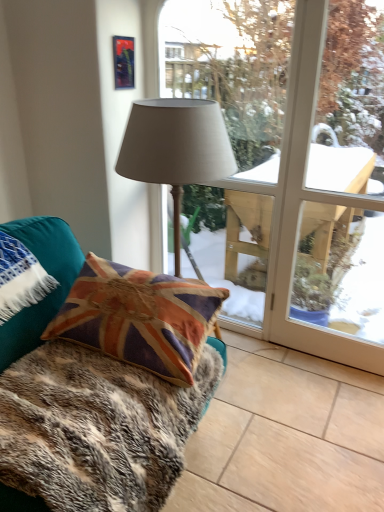
Question: Would you say metallic reflective picture frame at upper center is part of velvet union jack pillow at lower left's contents?

Choices:
 (A) no
 (B) yes

Answer: (A)

Question: Is velvet union jack pillow at lower left at the right side of metallic reflective picture frame at upper center?

Choices:
 (A) yes
 (B) no

Answer: (A)

Question: Are velvet union jack pillow at lower left and metallic reflective picture frame at upper center far apart?

Choices:
 (A) yes
 (B) no

Answer: (B)

Question: Does velvet union jack pillow at lower left have a greater width compared to metallic reflective picture frame at upper center?

Choices:
 (A) yes
 (B) no

Answer: (A)

Question: Can you confirm if velvet union jack pillow at lower left is taller than metallic reflective picture frame at upper center?

Choices:
 (A) yes
 (B) no

Answer: (A)

Question: Is velvet union jack pillow at lower left next to metallic reflective picture frame at upper center?

Choices:
 (A) no
 (B) yes

Answer: (A)

Question: Is matte gray lampshade at center positioned beyond the bounds of metallic reflective picture frame at upper center?

Choices:
 (A) yes
 (B) no

Answer: (A)

Question: Does matte gray lampshade at center have a larger size compared to metallic reflective picture frame at upper center?

Choices:
 (A) yes
 (B) no

Answer: (A)

Question: Does matte gray lampshade at center appear on the right side of metallic reflective picture frame at upper center?

Choices:
 (A) no
 (B) yes

Answer: (B)

Question: Is matte gray lampshade at center smaller than metallic reflective picture frame at upper center?

Choices:
 (A) no
 (B) yes

Answer: (A)

Question: From the image's perspective, is matte gray lampshade at center under metallic reflective picture frame at upper center?

Choices:
 (A) yes
 (B) no

Answer: (A)

Question: Is matte gray lampshade at center to the left of metallic reflective picture frame at upper center from the viewer's perspective?

Choices:
 (A) no
 (B) yes

Answer: (A)

Question: Considering the relative positions of matte gray fabric lamp at center and velvet union jack pillow at lower left in the image provided, is matte gray fabric lamp at center in front of velvet union jack pillow at lower left?

Choices:
 (A) yes
 (B) no

Answer: (B)